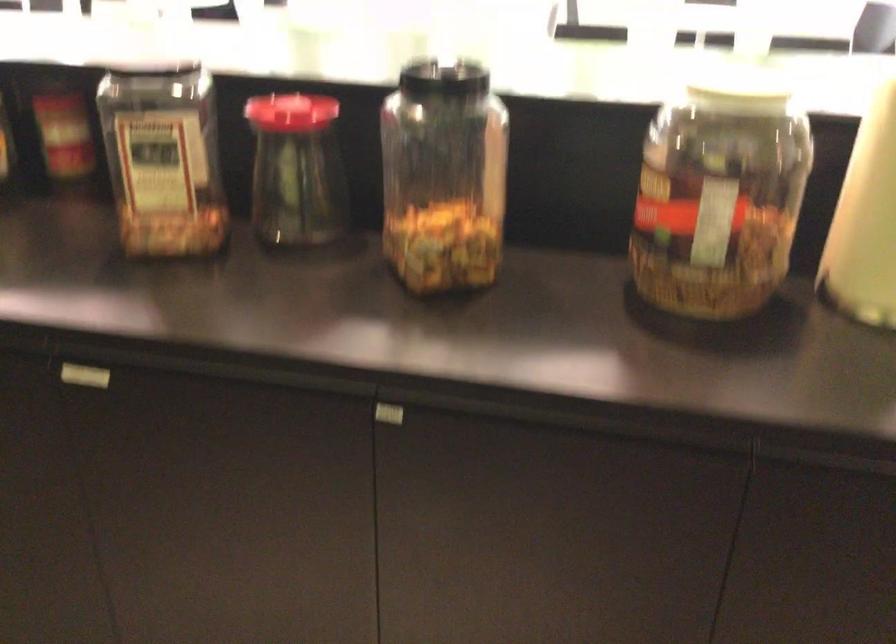
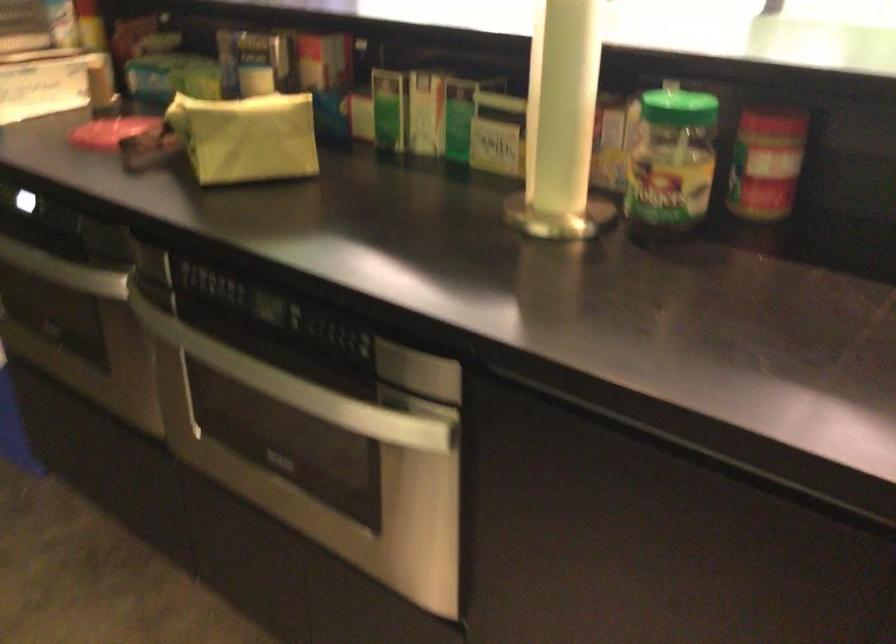
Question: How did the camera likely rotate?

Choices:
 (A) Left
 (B) Right
 (C) Up
 (D) Down

Answer: (A)